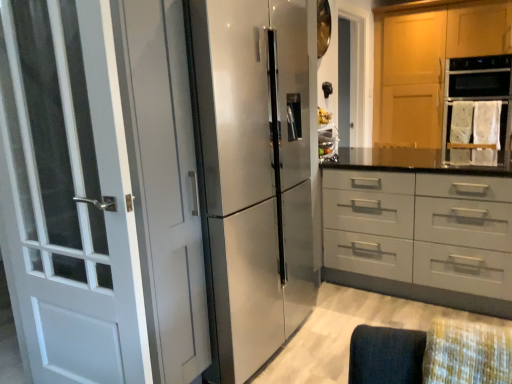
Question: Considering the relative sizes of satin silver refrigerator at center and matte gray drawer at center in the image provided, is satin silver refrigerator at center bigger than matte gray drawer at center?

Choices:
 (A) no
 (B) yes

Answer: (A)

Question: Could you tell me if satin silver refrigerator at center is turned towards matte gray drawer at center?

Choices:
 (A) no
 (B) yes

Answer: (A)

Question: Is satin silver refrigerator at center wider than matte gray drawer at center?

Choices:
 (A) yes
 (B) no

Answer: (B)

Question: Does satin silver refrigerator at center lie in front of matte gray drawer at center?

Choices:
 (A) yes
 (B) no

Answer: (A)

Question: Is satin silver refrigerator at center smaller than matte gray drawer at center?

Choices:
 (A) yes
 (B) no

Answer: (A)

Question: From the image's perspective, is satin silver refrigerator at center beneath matte gray drawer at center?

Choices:
 (A) yes
 (B) no

Answer: (B)

Question: Can we say matte gray drawer at center lies outside satin silver refrigerator at center?

Choices:
 (A) no
 (B) yes

Answer: (B)

Question: Could you tell me if matte gray drawer at center is facing satin silver refrigerator at center?

Choices:
 (A) no
 (B) yes

Answer: (B)

Question: Is matte gray drawer at center at the left side of satin silver refrigerator at center?

Choices:
 (A) no
 (B) yes

Answer: (A)

Question: From the image's perspective, does matte gray drawer at center appear lower than satin silver refrigerator at center?

Choices:
 (A) yes
 (B) no

Answer: (A)

Question: Can you confirm if matte gray drawer at center is bigger than satin silver refrigerator at center?

Choices:
 (A) no
 (B) yes

Answer: (B)

Question: Is matte gray drawer at center thinner than satin silver refrigerator at center?

Choices:
 (A) no
 (B) yes

Answer: (A)

Question: Is matte gray drawer at center further to camera compared to wooden cabinet at upper right?

Choices:
 (A) yes
 (B) no

Answer: (B)